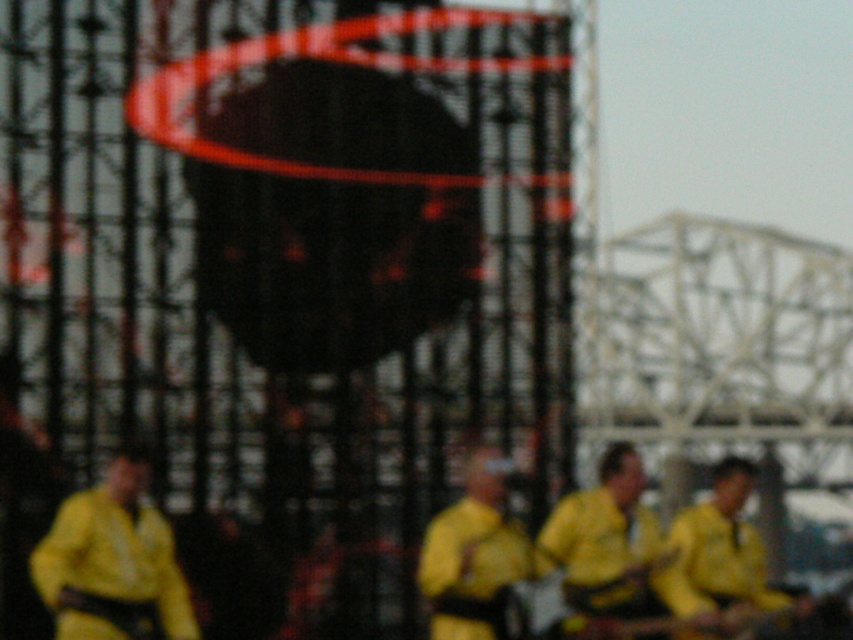
Question: Which object is closer to the camera taking this photo?

Choices:
 (A) yellow matte shirt at center
 (B) yellow matte uniform at center

Answer: (A)

Question: Is yellow matte jacket at lower left bigger than yellow matte shirt at center?

Choices:
 (A) no
 (B) yes

Answer: (A)

Question: Is yellow matte jacket at lower left below yellow matte uniform at center?

Choices:
 (A) no
 (B) yes

Answer: (B)

Question: Is yellow matte jacket at lower left positioned behind yellow matte guitar at center?

Choices:
 (A) no
 (B) yes

Answer: (A)

Question: Based on their relative distances, which object is nearer to the yellow matte shirt at center?

Choices:
 (A) yellow matte guitar at center
 (B) yellow matte jacket at lower left

Answer: (A)

Question: Which of the following is the closest to the observer?

Choices:
 (A) (109, 609)
 (B) (694, 547)
 (C) (448, 570)

Answer: (A)